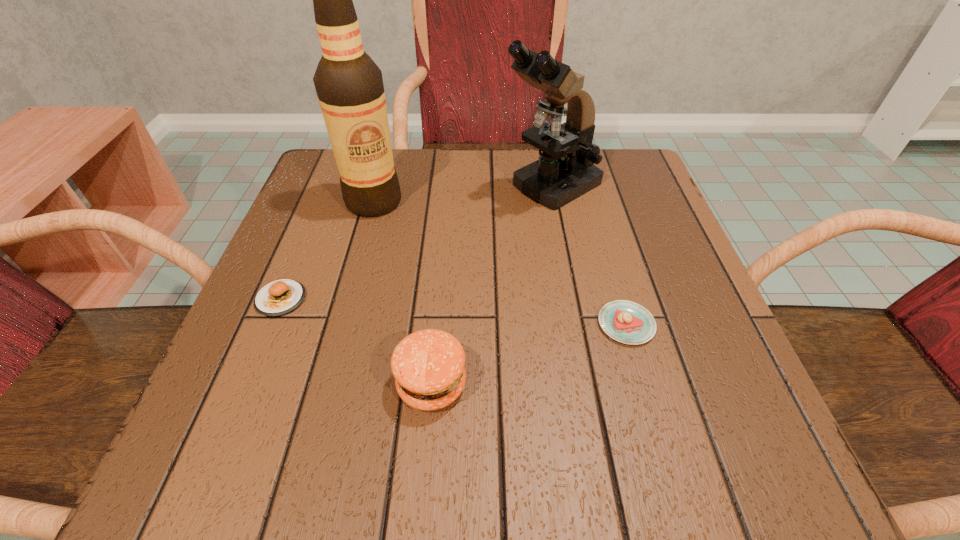
The height and width of the screenshot is (540, 960). In order to click on vacant area that lies between the pastry and the microscope in this screenshot , I will do `click(588, 255)`.

Find the location of `vacant region between the microscope and the pastry`. vacant region between the microscope and the pastry is located at coordinates (588, 255).

This screenshot has width=960, height=540. What are the coordinates of `free space between the tallest object and the pastry` in the screenshot? It's located at (500, 263).

Locate an element on the screen. The image size is (960, 540). free area in between the fourth shortest object and the left food is located at coordinates (417, 242).

Locate an element on the screen. Image resolution: width=960 pixels, height=540 pixels. free space between the pastry and the farther food is located at coordinates (453, 312).

What are the coordinates of `vacant area that lies between the microscope and the pastry` in the screenshot? It's located at (588, 255).

Find the location of a particular element. empty space between the second object from left to right and the second tallest object is located at coordinates (463, 194).

At what (x,y) coordinates should I click in order to perform the action: click on free area in between the second object from left to right and the pastry. Please return your answer as a coordinate pair (x, y). Image resolution: width=960 pixels, height=540 pixels. Looking at the image, I should click on (500, 263).

This screenshot has width=960, height=540. I want to click on unoccupied area between the fourth shortest object and the pastry, so click(x=588, y=255).

Find the location of a particular element. vacant area that lies between the tallest object and the microscope is located at coordinates (463, 194).